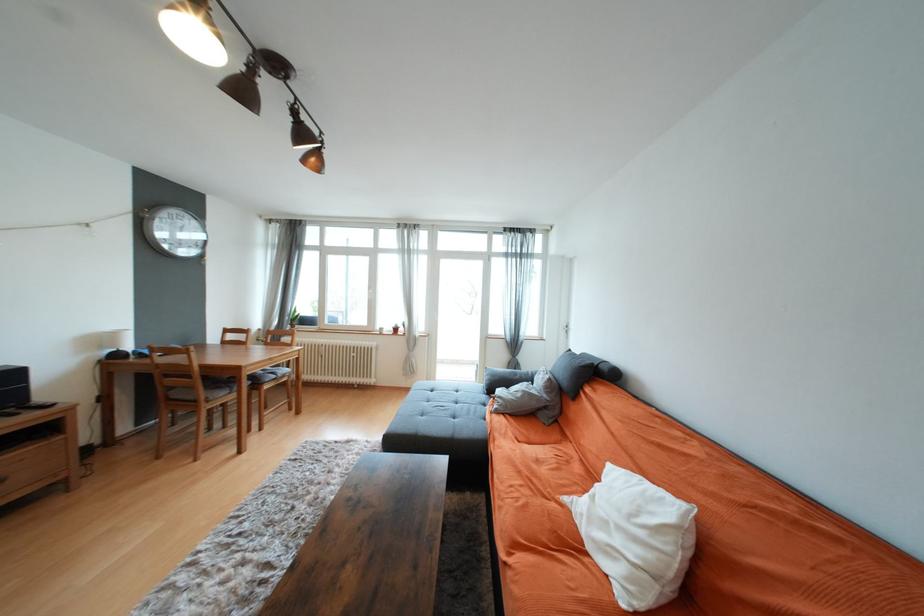
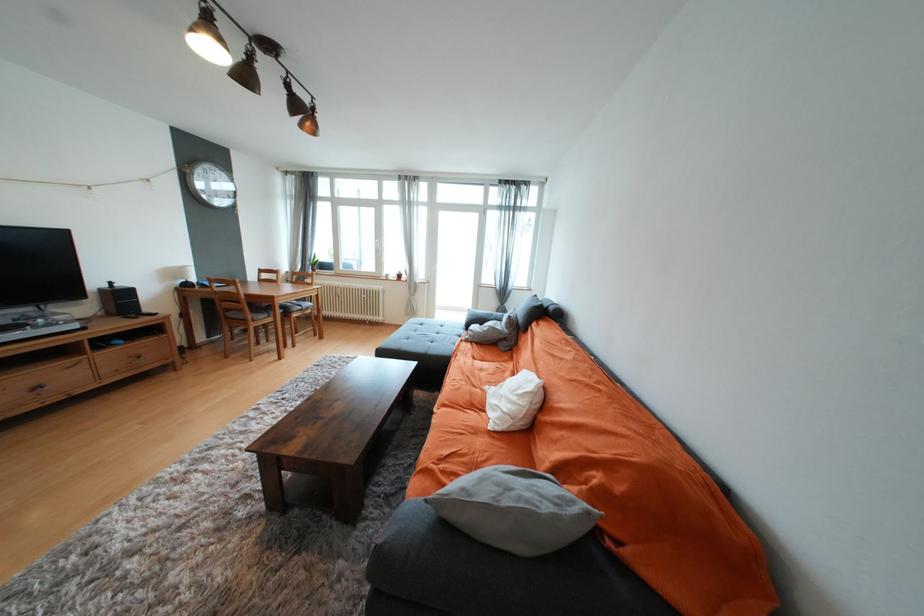
Where in the second image is the point corresponding to (x=360, y=350) from the first image?

(371, 293)